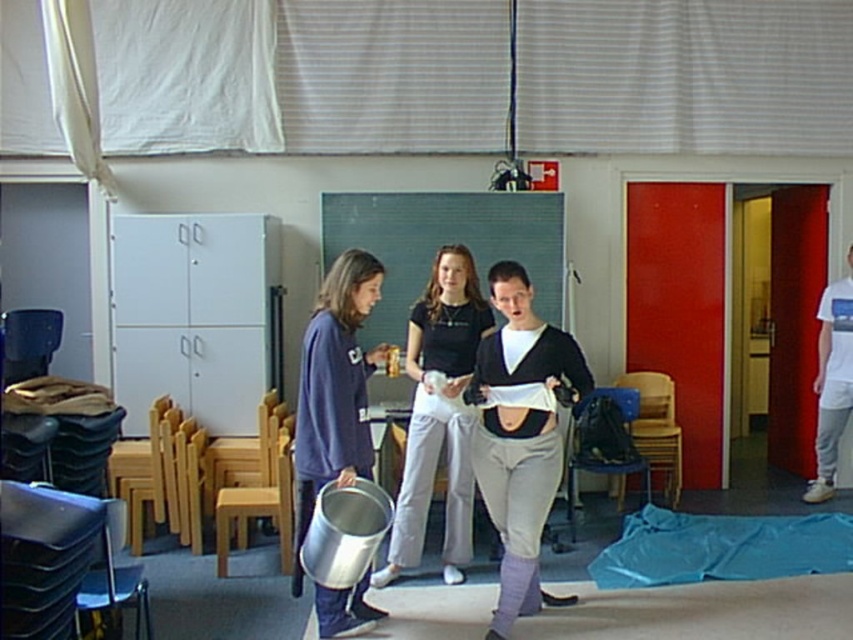
Question: Which object is farther from the camera taking this photo?

Choices:
 (A) matte purple sweatshirt at center
 (B) blue fabric tarp at lower right
 (C) matte black sweater at center

Answer: (B)

Question: Can you confirm if matte black sweater at center is positioned to the left of matte black shirt at center?

Choices:
 (A) yes
 (B) no

Answer: (B)

Question: Observing the image, what is the correct spatial positioning of matte purple sweatshirt at center in reference to blue fabric tarp at lower right?

Choices:
 (A) left
 (B) right

Answer: (A)

Question: Which object is closer to the camera taking this photo?

Choices:
 (A) matte black sweater at center
 (B) matte black shirt at center
 (C) matte purple sweatshirt at center
 (D) blue fabric tarp at lower right

Answer: (C)

Question: Which object appears farthest from the camera in this image?

Choices:
 (A) blue fabric tarp at lower right
 (B) matte black sweater at center

Answer: (A)

Question: Is matte black sweater at center positioned at the back of blue fabric tarp at lower right?

Choices:
 (A) yes
 (B) no

Answer: (B)